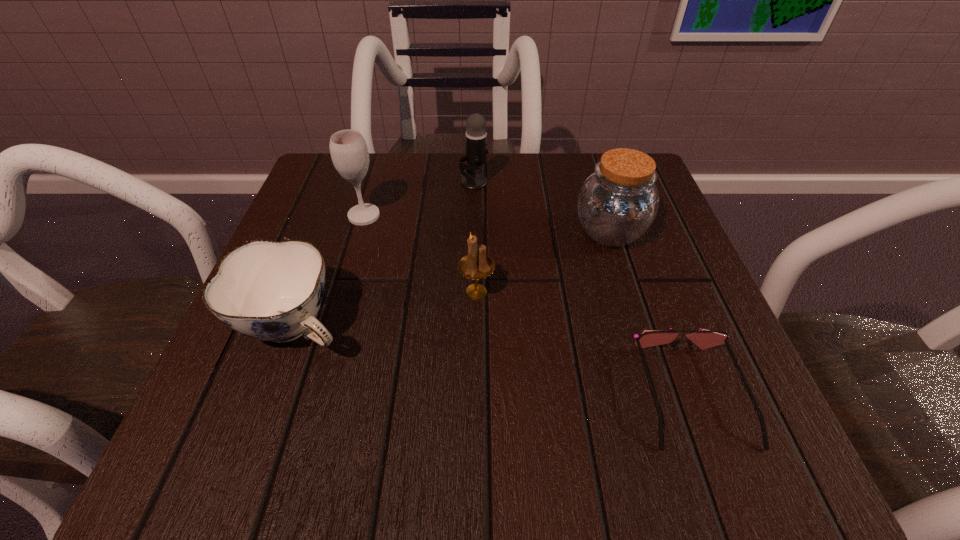
Identify the location of vacant space located on the front of the chinaware. (254, 441).

This screenshot has width=960, height=540. In order to click on wineglass that is at the far edge in this screenshot , I will do `click(349, 153)`.

The height and width of the screenshot is (540, 960). Find the location of `microphone present at the far edge`. microphone present at the far edge is located at coordinates (476, 136).

What are the coordinates of `jar present at the far edge` in the screenshot? It's located at (617, 204).

At what (x,y) coordinates should I click in order to perform the action: click on object situated at the near edge. Please return your answer as a coordinate pair (x, y). The width and height of the screenshot is (960, 540). Looking at the image, I should click on (704, 339).

Identify the location of wineglass at the left edge. (349, 153).

Find the location of `chinaware that is positioned at the left edge`. chinaware that is positioned at the left edge is located at coordinates (271, 291).

Identify the location of jar present at the right edge. (617, 204).

At what (x,y) coordinates should I click in order to perform the action: click on sunglasses positioned at the right edge. Please return your answer as a coordinate pair (x, y). Looking at the image, I should click on [704, 339].

Locate an element on the screen. object that is at the far left corner is located at coordinates (349, 153).